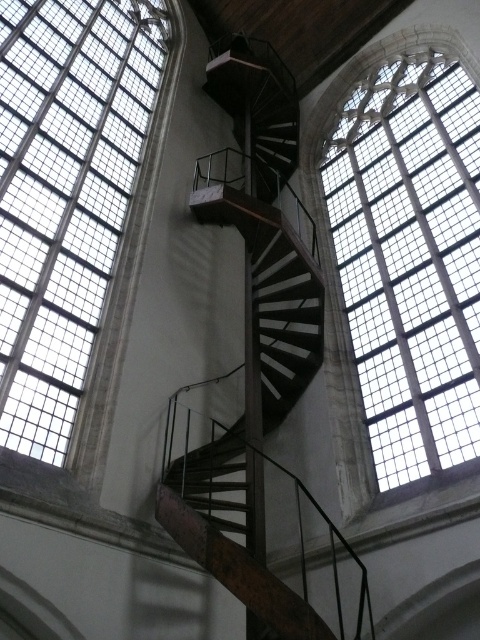
You are an architect visiting the cathedral and notice two clear glass windows. The clear glass window at upper left and the clear glass window at upper right. Which of these two windows has a narrower width?

The clear glass window at upper left is thinner than the clear glass window at upper right, so the clear glass window at upper left has a narrower width.